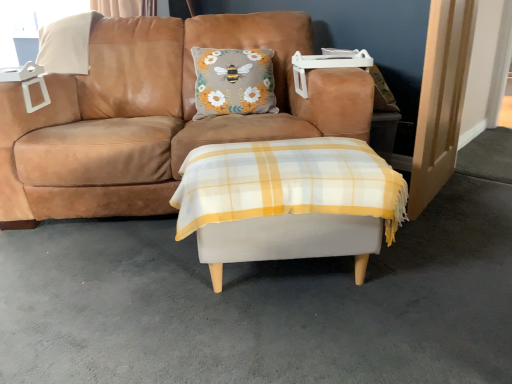
This screenshot has width=512, height=384. In order to click on white fabric ottoman at center in this screenshot , I will do `click(288, 201)`.

What do you see at coordinates (155, 115) in the screenshot? This screenshot has width=512, height=384. I see `suede tan couch at center` at bounding box center [155, 115].

Where is `white fabric ottoman at center`? This screenshot has height=384, width=512. white fabric ottoman at center is located at coordinates (288, 201).

Considering the sizes of light wood door at right and suede tan couch at center in the image, is light wood door at right wider or thinner than suede tan couch at center?

In the image, light wood door at right appears to be more narrow than suede tan couch at center.

Would you say light wood door at right is inside or outside suede tan couch at center?

light wood door at right is not inside suede tan couch at center, it's outside.

Looking at this image, between suede tan couch at center and white plastic window screen at upper left, which one has more height?

Standing taller between the two is suede tan couch at center.

Does suede tan couch at center have a smaller size compared to white plastic window screen at upper left?

No, suede tan couch at center is not smaller than white plastic window screen at upper left.

Locate an element on the screen. window screen that appears above the suede tan couch at center (from a real-world perspective) is located at coordinates (30, 21).

Is white fabric ottoman at center facing towards suede tan couch at center?

No, white fabric ottoman at center does not turn towards suede tan couch at center.

Considering the relative sizes of white fabric ottoman at center and suede tan couch at center in the image provided, is white fabric ottoman at center shorter than suede tan couch at center?

Yes, white fabric ottoman at center is shorter than suede tan couch at center.

Who is more distant, white fabric ottoman at center or suede tan couch at center?

suede tan couch at center is further from the camera.

Does white plastic window screen at upper left have a lesser width compared to white fabric ottoman at center?

Yes, white plastic window screen at upper left is thinner than white fabric ottoman at center.

From a real-world perspective, does white plastic window screen at upper left stand above white fabric ottoman at center?

Yes, from a real-world perspective, white plastic window screen at upper left is over white fabric ottoman at center

Considering the relative sizes of white plastic window screen at upper left and white fabric ottoman at center in the image provided, is white plastic window screen at upper left taller than white fabric ottoman at center?

Correct, white plastic window screen at upper left is much taller as white fabric ottoman at center.

Can you confirm if white plastic window screen at upper left is shorter than white fabric ottoman at center?

In fact, white plastic window screen at upper left may be taller than white fabric ottoman at center.

Is white plastic window screen at upper left wider than white fabric ottoman at center?

No.

Considering the relative sizes of white plastic window screen at upper left and white fabric ottoman at center in the image provided, is white plastic window screen at upper left smaller than white fabric ottoman at center?

Yes.

From a real-world perspective, is white plastic window screen at upper left below white fabric ottoman at center?

Actually, white plastic window screen at upper left is physically above white fabric ottoman at center in the real world.

Where is `table behind the white fabric ottoman at center`? Image resolution: width=512 pixels, height=384 pixels. table behind the white fabric ottoman at center is located at coordinates (288, 201).

Can you confirm if white fabric ottoman at center is thinner than white fabric ottoman at center?

Indeed, white fabric ottoman at center has a lesser width compared to white fabric ottoman at center.

How different are the orientations of white fabric ottoman at center and white fabric ottoman at center in degrees?

white fabric ottoman at center and white fabric ottoman at center are facing 138 degrees away from each other.

Does white fabric ottoman at center have a lesser height compared to white fabric ottoman at center?

Incorrect, the height of white fabric ottoman at center does not fall short of that of white fabric ottoman at center.

From a real-world perspective, is suede tan couch at center below light wood door at right?

Yes, from a real-world perspective, suede tan couch at center is below light wood door at right.

Considering the sizes of objects suede tan couch at center and light wood door at right in the image provided, who is bigger, suede tan couch at center or light wood door at right?

suede tan couch at center is bigger.

Can you confirm if suede tan couch at center is positioned to the right of light wood door at right?

→ Incorrect, suede tan couch at center is not on the right side of light wood door at right.

Is suede tan couch at center oriented away from light wood door at right?

A: No, suede tan couch at center is not facing the opposite direction of light wood door at right.

Find the location of a particular element. door below the suede tan couch at center (from the image's perspective) is located at coordinates [x=441, y=99].

At what (x,y) coordinates should I click in order to perform the action: click on window screen lying on the left of suede tan couch at center. Please return your answer as a coordinate pair (x, y). Image resolution: width=512 pixels, height=384 pixels. Looking at the image, I should click on (30, 21).

Which object lies further to the anchor point white fabric ottoman at center, light wood door at right or white fabric ottoman at center?

light wood door at right.

From the image, which object appears to be nearer to white fabric ottoman at center, white fabric ottoman at center or white plastic window screen at upper left?

white fabric ottoman at center.

Estimate the real-world distances between objects in this image. Which object is further from suede tan couch at center, white fabric ottoman at center or white fabric ottoman at center?

white fabric ottoman at center is positioned further to the anchor suede tan couch at center.

Based on their spatial positions, is white fabric ottoman at center or white plastic window screen at upper left further from white fabric ottoman at center?

white plastic window screen at upper left.

Estimate the real-world distances between objects in this image. Which object is further from white fabric ottoman at center, white plastic window screen at upper left or suede tan couch at center?

white plastic window screen at upper left lies further to white fabric ottoman at center than the other object.

Considering their positions, is light wood door at right positioned closer to white fabric ottoman at center than white plastic window screen at upper left?

Among the two, light wood door at right is located nearer to white fabric ottoman at center.

Considering their positions, is white plastic window screen at upper left positioned closer to white fabric ottoman at center than light wood door at right?

Based on the image, light wood door at right appears to be nearer to white fabric ottoman at center.

Which object lies nearer to the anchor point light wood door at right, white fabric ottoman at center or suede tan couch at center?

white fabric ottoman at center.

Locate an element on the screen. studio couch between white fabric ottoman at center and white plastic window screen at upper left from front to back is located at coordinates (155, 115).

Identify the location of concrete situated between suede tan couch at center and light wood door at right from left to right. (269, 299).

At what (x,y) coordinates should I click in order to perform the action: click on studio couch between white plastic window screen at upper left and light wood door at right from left to right. Please return your answer as a coordinate pair (x, y). This screenshot has width=512, height=384. Looking at the image, I should click on (155, 115).

Identify the location of table situated between white plastic window screen at upper left and light wood door at right from left to right. This screenshot has height=384, width=512. (288, 201).